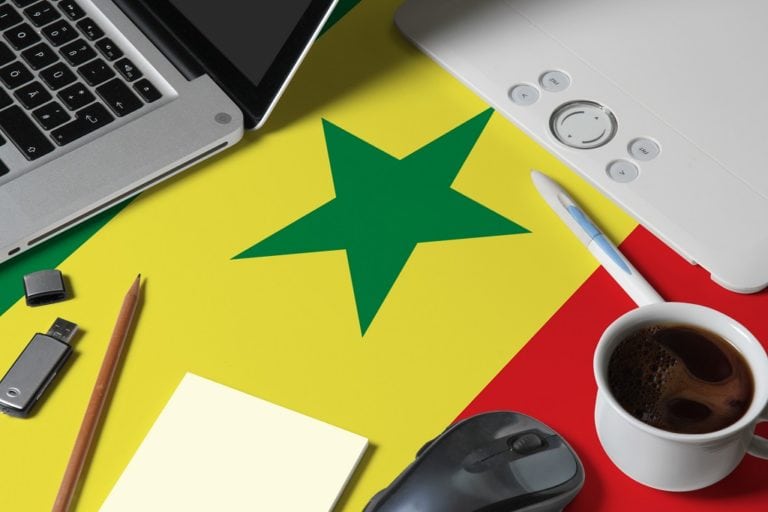
Locate an element on the screen. blank white paper is located at coordinates pyautogui.click(x=207, y=462).